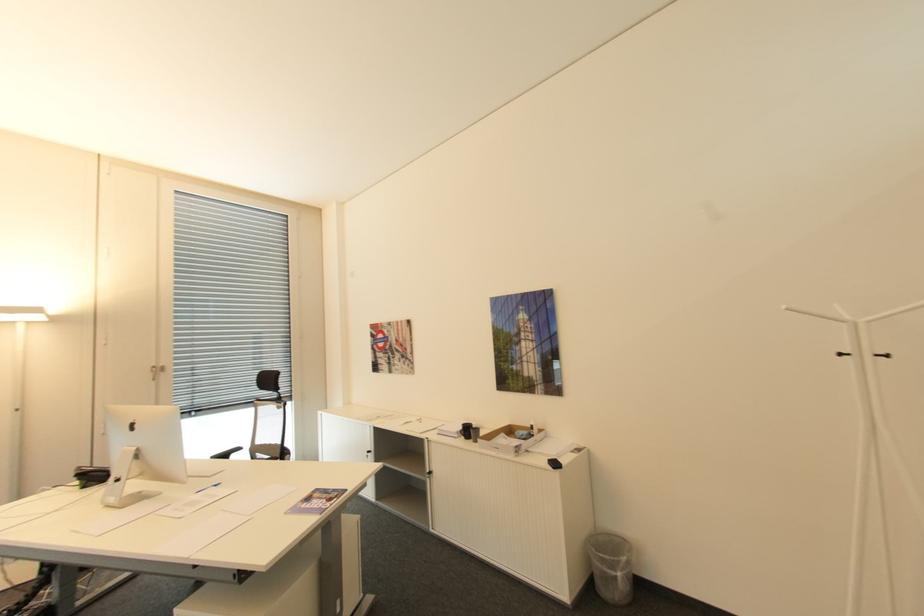
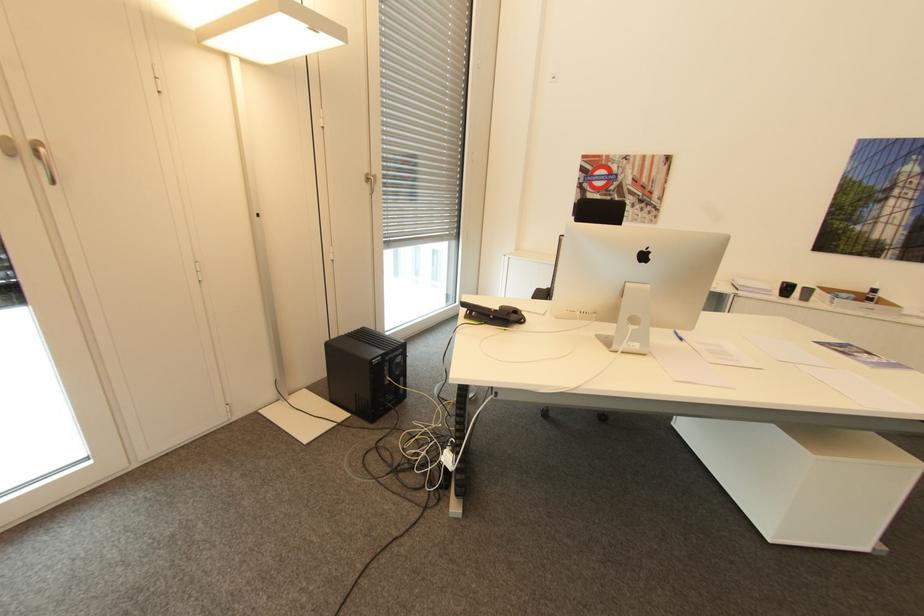
Where in the second image is the point corresponding to point (536, 427) from the first image?

(879, 290)